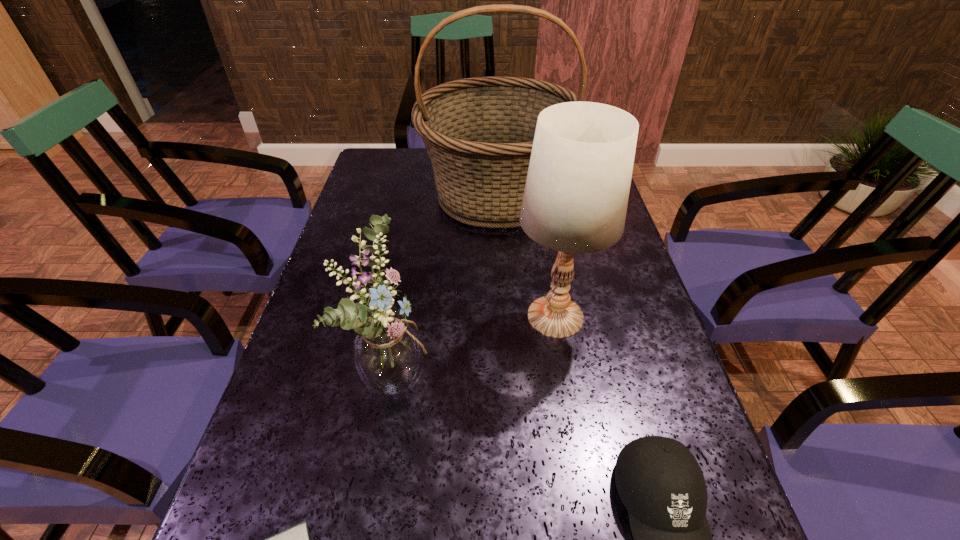
Where is `object identified as the third closest to the lamp`? object identified as the third closest to the lamp is located at coordinates (659, 481).